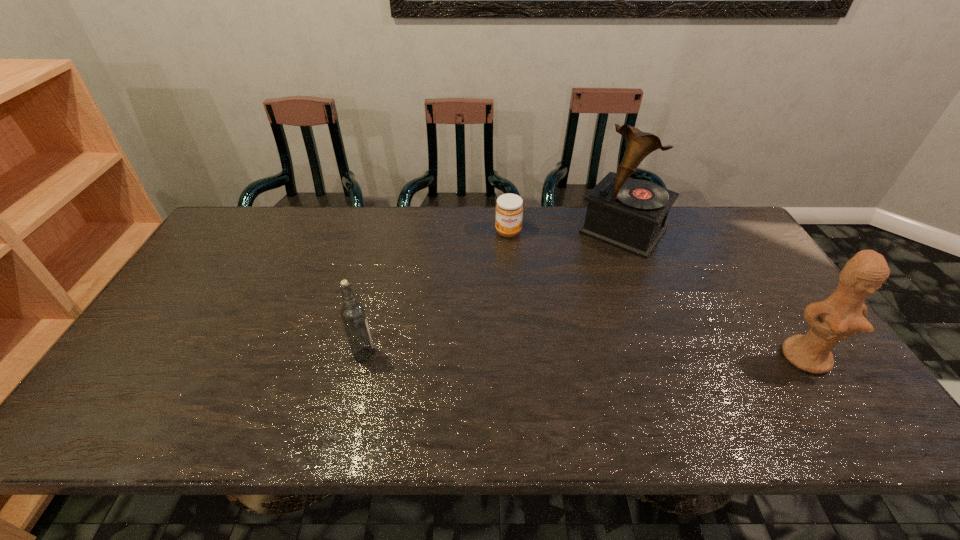
Where is `free region located on the front label of the shortest object`? free region located on the front label of the shortest object is located at coordinates (516, 288).

At what (x,y) coordinates should I click in order to perform the action: click on vacant space situated 0.400m on the front label of the shortest object. Please return your answer as a coordinate pair (x, y). Looking at the image, I should click on (523, 336).

Where is `free space located 0.110m at the horn opening of the phonograph_record`? The width and height of the screenshot is (960, 540). free space located 0.110m at the horn opening of the phonograph_record is located at coordinates (588, 273).

At what (x,y) coordinates should I click in order to perform the action: click on free location located at the horn opening of the phonograph_record. Please return your answer as a coordinate pair (x, y). Image resolution: width=960 pixels, height=540 pixels. Looking at the image, I should click on (570, 297).

Where is `vacant space located 0.190m at the horn opening of the phonograph_record`? This screenshot has height=540, width=960. vacant space located 0.190m at the horn opening of the phonograph_record is located at coordinates (576, 289).

The image size is (960, 540). I want to click on jam situated at the far edge, so click(509, 209).

Locate an element on the screen. phonograph_record positioned at the far edge is located at coordinates (629, 214).

Where is `object that is at the near edge`? The height and width of the screenshot is (540, 960). object that is at the near edge is located at coordinates (841, 315).

Identify the location of object located in the right edge section of the desktop. The width and height of the screenshot is (960, 540). (841, 315).

You are a GUI agent. You are given a task and a screenshot of the screen. Output one action in this format:
    pyautogui.click(x=<x>, y=<y>)
    Task: Click on the object situated at the near right corner
    
    Given the screenshot: What is the action you would take?
    pyautogui.click(x=841, y=315)